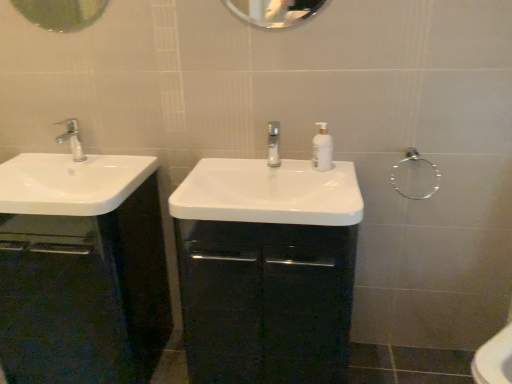
Question: In terms of width, does white glossy sink at center, which is the 2th sink from left to right, look wider or thinner when compared to clear glass mirror at upper center, the second mirror viewed from the left?

Choices:
 (A) thin
 (B) wide

Answer: (B)

Question: From the image's perspective, is white glossy sink at center, arranged as the 1th sink when viewed from the right, positioned above or below clear glass mirror at upper center, the second mirror viewed from the left?

Choices:
 (A) below
 (B) above

Answer: (A)

Question: Which object is positioned farthest from the white glossy sink at left, the second sink in the right-to-left sequence?

Choices:
 (A) silver metallic faucet at left, the second tap when ordered from right to left
 (B) clear glass tap at center, the 1th tap from the right
 (C) glossy black cabinet at center, which is the 2th bathroom cabinet in left-to-right order
 (D) white glossy sink at center, which is the 2th sink from left to right
 (E) clear glass mirror at upper center, the second mirror viewed from the left

Answer: (E)

Question: Which of these objects is positioned closest to the glossy black cabinet at center, which is the 2th bathroom cabinet in left-to-right order?

Choices:
 (A) clear glass tap at center, the 2th tap positioned from the left
 (B) white glossy sink at center, arranged as the 1th sink when viewed from the right
 (C) metallic circular mirror at upper left, which is the second mirror from right to left
 (D) clear glass towel ring at upper right
 (E) white glossy soap dispenser at center

Answer: (B)